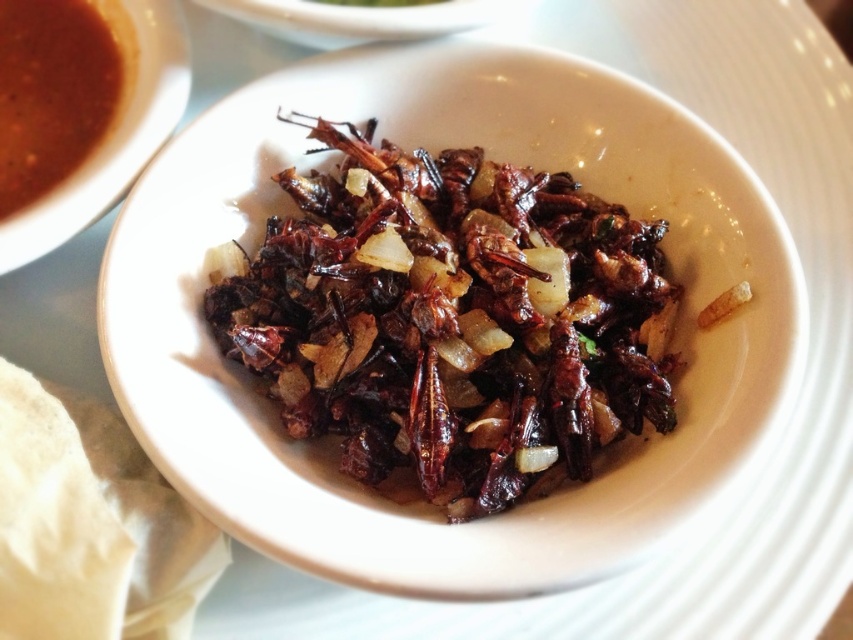
In the scene shown: You are a food critic standing at the edge of a table where the dish is placed. You want to reach for the closest point to your current position. Which point should you choose between point (378, 381) and point (68, 125)?

Point (68, 125) is closer to you because it is behind point (378, 381), so you should choose point (68, 125).